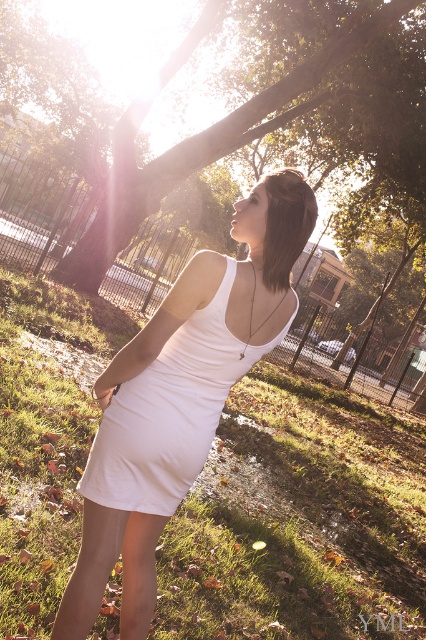
Which is below, white fabric dress at center or green leafy tree at upper center?

white fabric dress at center is lower down.

Is white fabric dress at center positioned behind green leafy tree at upper center?

No, white fabric dress at center is closer to the viewer.

Where is `white fabric dress at center`? white fabric dress at center is located at coordinates (169, 412).

Identify the location of white matte dress at center. This screenshot has height=640, width=426. (180, 397).

Does point (192, 262) lie in front of point (253, 102)?

That is True.

Which is behind, point (109, 420) or point (221, 132)?

The point (221, 132) is more distant.

I want to click on white matte dress at center, so click(180, 397).

Is white matte dress at center to the right of white fabric dress at center from the viewer's perspective?

In fact, white matte dress at center is to the left of white fabric dress at center.

Who is positioned more to the right, white matte dress at center or white fabric dress at center?

white fabric dress at center is more to the right.

Where is `white matte dress at center`? white matte dress at center is located at coordinates (180, 397).

Where is `white matte dress at center`? This screenshot has height=640, width=426. white matte dress at center is located at coordinates (180, 397).